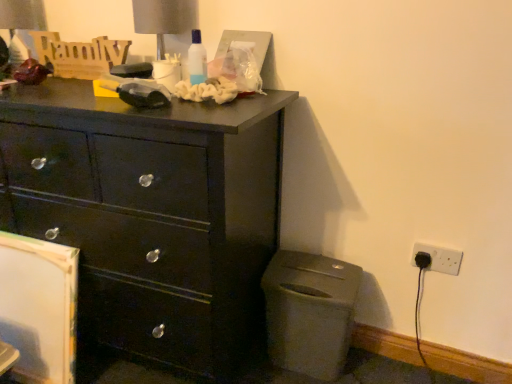
Question: Does white plastic electrical outlet at lower right, which is the 2th electric outlet in left-to-right order, have a lesser width compared to matte black chest of drawers at left?

Choices:
 (A) yes
 (B) no

Answer: (A)

Question: Considering the relative sizes of white plastic electrical outlet at lower right, which is counted as the first electric outlet, starting from the right, and matte black chest of drawers at left in the image provided, is white plastic electrical outlet at lower right, which is counted as the first electric outlet, starting from the right, bigger than matte black chest of drawers at left?

Choices:
 (A) no
 (B) yes

Answer: (A)

Question: Can you confirm if white plastic electrical outlet at lower right, which is the 2th electric outlet in left-to-right order, is shorter than matte black chest of drawers at left?

Choices:
 (A) yes
 (B) no

Answer: (A)

Question: From the image's perspective, is white plastic electrical outlet at lower right, which is the 2th electric outlet in left-to-right order, below matte black chest of drawers at left?

Choices:
 (A) yes
 (B) no

Answer: (A)

Question: Is white plastic electrical outlet at lower right, which is the 2th electric outlet in left-to-right order, placed right next to matte black chest of drawers at left?

Choices:
 (A) yes
 (B) no

Answer: (B)

Question: In terms of width, does white plastic electrical outlet at lower right, which is counted as the first electric outlet, starting from the right, look wider or thinner when compared to metallic gray table lamp at upper center?

Choices:
 (A) thin
 (B) wide

Answer: (A)

Question: Looking at the image, does white plastic electrical outlet at lower right, which is counted as the first electric outlet, starting from the right, seem bigger or smaller compared to metallic gray table lamp at upper center?

Choices:
 (A) small
 (B) big

Answer: (A)

Question: Visually, is white plastic electrical outlet at lower right, which is the 2th electric outlet in left-to-right order, positioned to the left or to the right of metallic gray table lamp at upper center?

Choices:
 (A) right
 (B) left

Answer: (A)

Question: Would you say white plastic electrical outlet at lower right, which is the 2th electric outlet in left-to-right order, is inside or outside metallic gray table lamp at upper center?

Choices:
 (A) outside
 (B) inside

Answer: (A)

Question: Is white plastic electrical outlet at lower right, which is the 2th electric outlet in left-to-right order, inside the boundaries of black plastic electric outlet at lower right, which is the 1th electric outlet in left-to-right order, or outside?

Choices:
 (A) outside
 (B) inside

Answer: (A)

Question: From a real-world perspective, is white plastic electrical outlet at lower right, which is counted as the first electric outlet, starting from the right, physically located above or below black plastic electric outlet at lower right, the second electric outlet when ordered from right to left?

Choices:
 (A) above
 (B) below

Answer: (A)

Question: Is white plastic electrical outlet at lower right, which is the 2th electric outlet in left-to-right order, taller or shorter than black plastic electric outlet at lower right, the second electric outlet when ordered from right to left?

Choices:
 (A) short
 (B) tall

Answer: (B)

Question: Is white plastic electrical outlet at lower right, which is the 2th electric outlet in left-to-right order, in front of or behind black plastic electric outlet at lower right, which is the 1th electric outlet in left-to-right order, in the image?

Choices:
 (A) front
 (B) behind

Answer: (A)

Question: Would you say white plastic electrical outlet at lower right, which is counted as the first electric outlet, starting from the right, is to the left or to the right of matte plastic trash can at lower right in the picture?

Choices:
 (A) left
 (B) right

Answer: (B)

Question: Considering the positions of point (416, 249) and point (325, 289), is point (416, 249) closer or farther from the camera than point (325, 289)?

Choices:
 (A) closer
 (B) farther

Answer: (B)